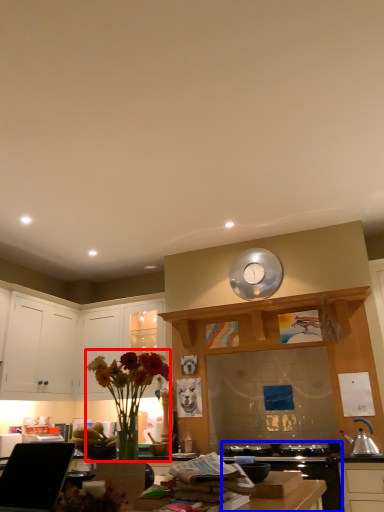
Question: Which of the following is the farthest to the observer, floral arrangement (highlighted by a red box) or appliance (highlighted by a blue box)?

Choices:
 (A) floral arrangement
 (B) appliance

Answer: (B)